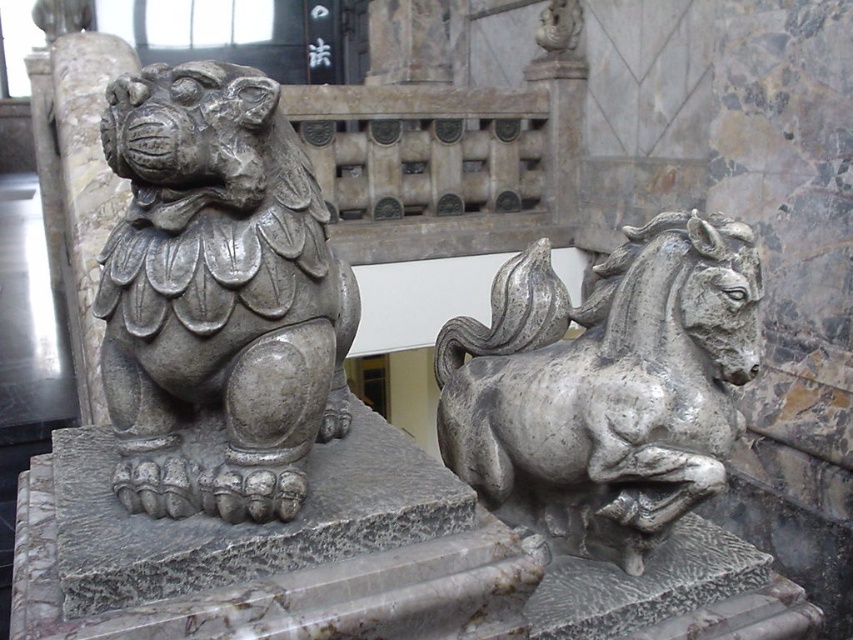
Who is more forward, (163, 317) or (508, 296)?

Point (163, 317)

Is gray stone lion at left bigger than gray stone horse at right?

Incorrect, gray stone lion at left is not larger than gray stone horse at right.

Describe the element at coordinates (218, 296) in the screenshot. I see `gray stone lion at left` at that location.

This screenshot has height=640, width=853. Identify the location of gray stone lion at left. (218, 296).